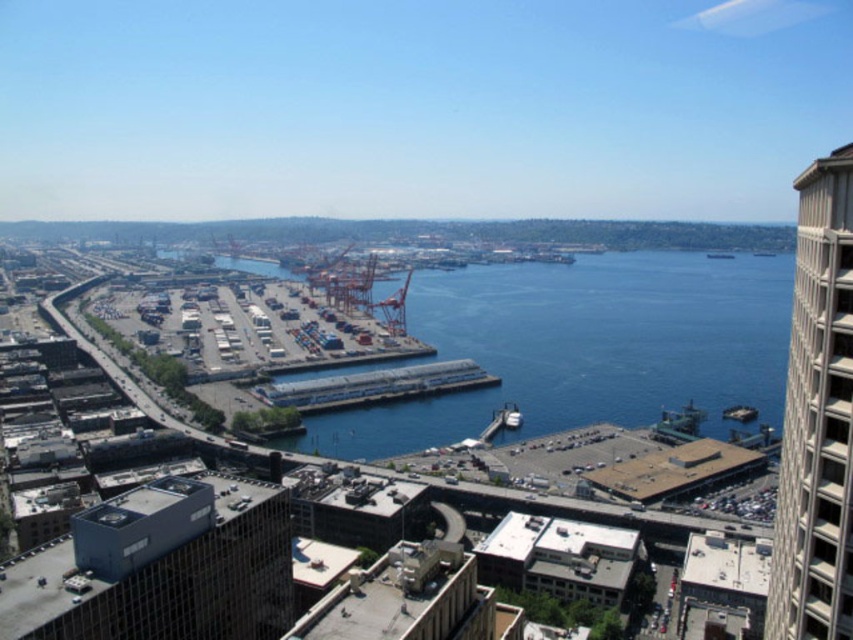
Question: Is blue water at center to the left of white concrete dock at center from the viewer's perspective?

Choices:
 (A) no
 (B) yes

Answer: (A)

Question: Is white concrete dock at center in front of metallic silver boat at center?

Choices:
 (A) no
 (B) yes

Answer: (A)

Question: Is blue water at center below metallic silver boat at center?

Choices:
 (A) no
 (B) yes

Answer: (A)

Question: Among these points, which one is farthest from the camera?

Choices:
 (A) (717, 292)
 (B) (376, 372)

Answer: (A)

Question: Which object appears closest to the camera in this image?

Choices:
 (A) white concrete dock at center
 (B) blue water at center

Answer: (B)

Question: Which point is farther to the camera?

Choices:
 (A) (390, 374)
 (B) (532, 272)

Answer: (B)